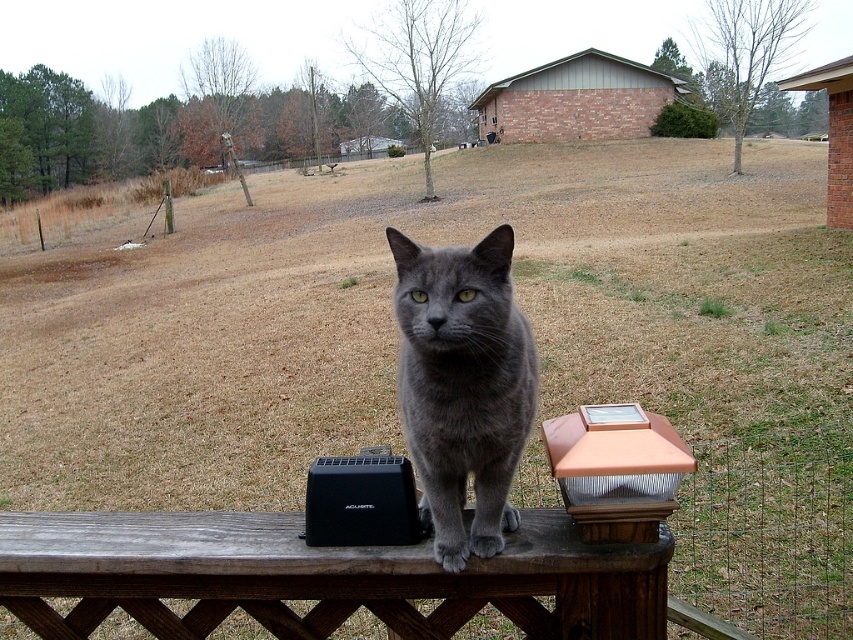
Which is behind, point (560, 586) or point (631, 477)?

Positioned behind is point (560, 586).

Which is more to the left, wooden bench at center or copper metallic solar light post at center?

Positioned to the left is wooden bench at center.

Is point (38, 522) in front of point (621, 481)?

No, it is behind (621, 481).

You are a GUI agent. You are given a task and a screenshot of the screen. Output one action in this format:
    pyautogui.click(x=<x>, y=<y>)
    Task: Click on the wooden bench at center
    This screenshot has height=640, width=853.
    Given the screenshot: What is the action you would take?
    pyautogui.click(x=318, y=577)

Who is positioned more to the left, gray matte fur cat at center or copper metallic solar light post at center?

From the viewer's perspective, gray matte fur cat at center appears more on the left side.

Which is behind, point (442, 540) or point (660, 467)?

Positioned behind is point (442, 540).

Is point (456, 461) positioned after point (657, 442)?

Yes, it is behind point (657, 442).

Where is `gray matte fur cat at center`? Image resolution: width=853 pixels, height=640 pixels. gray matte fur cat at center is located at coordinates (462, 387).

Is wooden bench at center to the right of gray matte fur cat at center from the viewer's perspective?

In fact, wooden bench at center is to the left of gray matte fur cat at center.

Is point (386, 556) less distant than point (535, 396)?

That is True.

Describe the element at coordinates (318, 577) in the screenshot. This screenshot has width=853, height=640. I see `wooden bench at center` at that location.

You are a GUI agent. You are given a task and a screenshot of the screen. Output one action in this format:
    pyautogui.click(x=<x>, y=<y>)
    Task: Click on the wooden bench at center
    This screenshot has height=640, width=853.
    Given the screenshot: What is the action you would take?
    pyautogui.click(x=318, y=577)